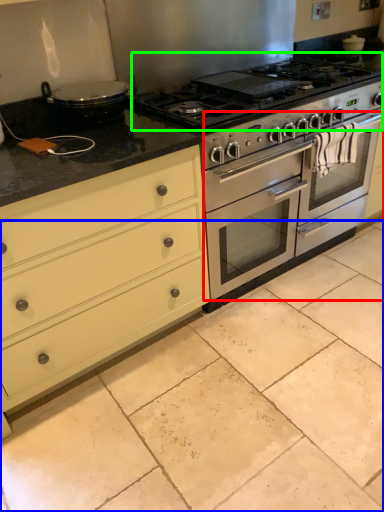
Question: Considering the real-world distances, which object is farthest from oven (highlighted by a red box)? ceramic tile (highlighted by a blue box) or gas stove (highlighted by a green box)?

Choices:
 (A) ceramic tile
 (B) gas stove

Answer: (A)